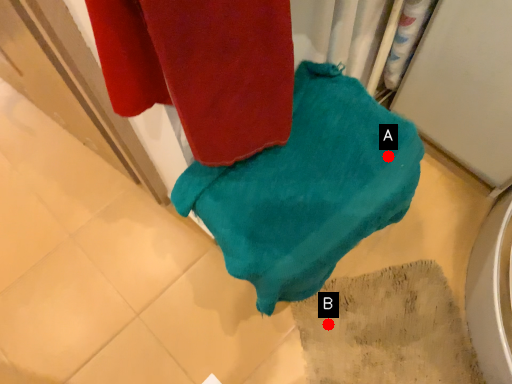
Question: Two points are circled on the image, labeled by A and B beside each circle. Which of the following is the farthest from the observer?

Choices:
 (A) A is further
 (B) B is further

Answer: (B)